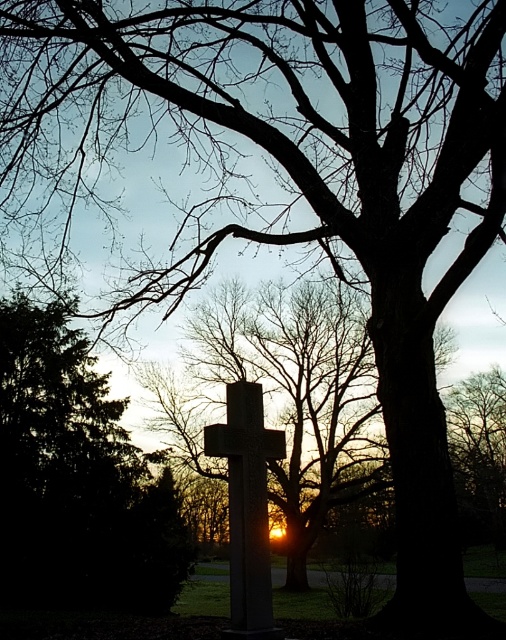
Question: Which point appears closest to the camera in this image?

Choices:
 (A) (244, 525)
 (B) (125, 595)

Answer: (A)

Question: Can you confirm if green leafy tree at left is positioned to the left of smooth stone cross at center?

Choices:
 (A) yes
 (B) no

Answer: (A)

Question: Which object is closer to the camera taking this photo?

Choices:
 (A) green leafy tree at left
 (B) smooth stone cross at center

Answer: (B)

Question: Among these points, which one is nearest to the camera?

Choices:
 (A) (256, 436)
 (B) (41, 596)

Answer: (A)

Question: Does green leafy tree at left appear over smooth stone cross at center?

Choices:
 (A) no
 (B) yes

Answer: (A)

Question: Is green leafy tree at left to the left of smooth stone cross at center from the viewer's perspective?

Choices:
 (A) no
 (B) yes

Answer: (B)